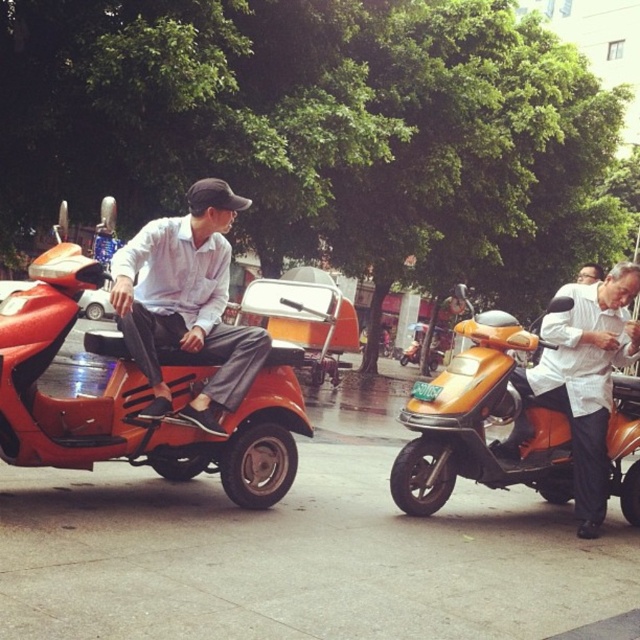
Question: Which of the following is the closest to the observer?

Choices:
 (A) orange matte scooter at left
 (B) white glossy shirt at right
 (C) orange matte scooter at center

Answer: (A)

Question: Can you confirm if orange matte scooter at left is positioned above white glossy shirt at right?

Choices:
 (A) no
 (B) yes

Answer: (B)

Question: Which of the following is the closest to the observer?

Choices:
 (A) orange matte scooter at left
 (B) white glossy shirt at right
 (C) matte white shirt at center

Answer: (A)

Question: Which point is closer to the camera?

Choices:
 (A) white glossy shirt at right
 (B) orange matte scooter at center

Answer: (B)

Question: Can you confirm if orange matte scooter at left is wider than matte white shirt at center?

Choices:
 (A) yes
 (B) no

Answer: (A)

Question: Can you confirm if matte white shirt at center is bigger than white glossy shirt at right?

Choices:
 (A) yes
 (B) no

Answer: (A)